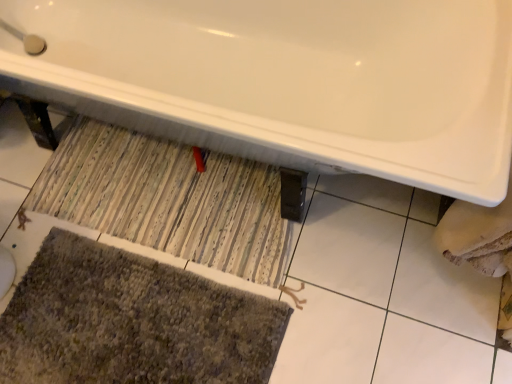
Locate an element on the screen. The width and height of the screenshot is (512, 384). vacant location behind textured gray bath mat at lower left is located at coordinates (129, 193).